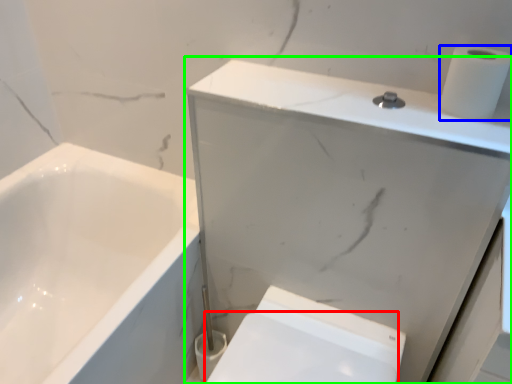
Question: Considering the real-world distances, which object is farthest from bidet (highlighted by a red box)? toilet paper (highlighted by a blue box) or medicine cabinet (highlighted by a green box)?

Choices:
 (A) toilet paper
 (B) medicine cabinet

Answer: (A)